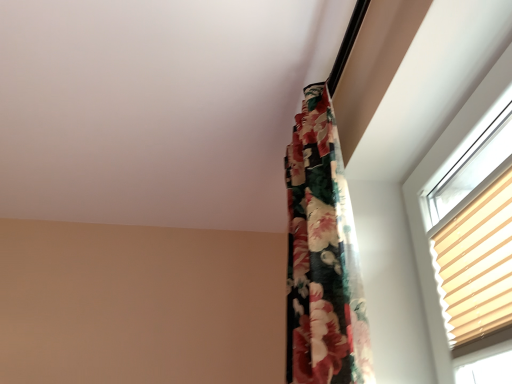
The height and width of the screenshot is (384, 512). What do you see at coordinates (322, 256) in the screenshot?
I see `floral fabric curtain at upper right` at bounding box center [322, 256].

The height and width of the screenshot is (384, 512). I want to click on floral fabric curtain at upper right, so click(x=322, y=256).

Where is `beige pleated blind at upper right`? This screenshot has width=512, height=384. beige pleated blind at upper right is located at coordinates (476, 265).

Describe the element at coordinates (476, 265) in the screenshot. Image resolution: width=512 pixels, height=384 pixels. I see `beige pleated blind at upper right` at that location.

What is the approximate width of beige pleated blind at upper right?

beige pleated blind at upper right is 1.61 inches in width.

Locate an element on the screen. This screenshot has width=512, height=384. floral fabric curtain at upper right is located at coordinates (322, 256).

Between beige pleated blind at upper right and floral fabric curtain at upper right, which one appears on the left side from the viewer's perspective?

floral fabric curtain at upper right is more to the left.

Is beige pleated blind at upper right positioned before floral fabric curtain at upper right?

Yes, it is.

Which is farther, [485,306] or [295,159]?

The point [295,159] is farther.

From the image's perspective, is beige pleated blind at upper right on floral fabric curtain at upper right?

Actually, beige pleated blind at upper right appears below floral fabric curtain at upper right in the image.

From a real-world perspective, who is located lower, beige pleated blind at upper right or floral fabric curtain at upper right?

From a 3D spatial view, beige pleated blind at upper right is below.

In terms of width, does beige pleated blind at upper right look wider or thinner when compared to floral fabric curtain at upper right?

Clearly, beige pleated blind at upper right has less width compared to floral fabric curtain at upper right.

Who is shorter, beige pleated blind at upper right or floral fabric curtain at upper right?

beige pleated blind at upper right is shorter.

Which of these two, beige pleated blind at upper right or floral fabric curtain at upper right, is bigger?

With larger size is floral fabric curtain at upper right.

Is floral fabric curtain at upper right surrounded by beige pleated blind at upper right?

No, beige pleated blind at upper right does not contain floral fabric curtain at upper right.

Is beige pleated blind at upper right directly adjacent to floral fabric curtain at upper right?

No.

Is beige pleated blind at upper right facing towards floral fabric curtain at upper right?

No, beige pleated blind at upper right is not facing towards floral fabric curtain at upper right.

How distant is beige pleated blind at upper right from floral fabric curtain at upper right?

beige pleated blind at upper right and floral fabric curtain at upper right are 11.76 inches apart.

You are a GUI agent. You are given a task and a screenshot of the screen. Output one action in this format:
    pyautogui.click(x=<x>, y=<y>)
    Task: Click on the blind on the right of floral fabric curtain at upper right
    The height and width of the screenshot is (384, 512).
    Given the screenshot: What is the action you would take?
    pyautogui.click(x=476, y=265)

Considering the positions of objects floral fabric curtain at upper right and beige pleated blind at upper right in the image provided, who is more to the right, floral fabric curtain at upper right or beige pleated blind at upper right?

From the viewer's perspective, beige pleated blind at upper right appears more on the right side.

Is floral fabric curtain at upper right in front of or behind beige pleated blind at upper right in the image?

In the image, floral fabric curtain at upper right appears behind beige pleated blind at upper right.

Looking at this image, which is closer to the camera, (332, 184) or (473, 305)?

Point (332, 184).

From the image's perspective, between floral fabric curtain at upper right and beige pleated blind at upper right, who is located below?

From the image's view, beige pleated blind at upper right is below.

From a real-world perspective, which is physically above, floral fabric curtain at upper right or beige pleated blind at upper right?

floral fabric curtain at upper right, from a real-world perspective.

Considering the sizes of objects floral fabric curtain at upper right and beige pleated blind at upper right in the image provided, who is wider, floral fabric curtain at upper right or beige pleated blind at upper right?

With larger width is floral fabric curtain at upper right.

Considering the sizes of floral fabric curtain at upper right and beige pleated blind at upper right in the image, is floral fabric curtain at upper right taller or shorter than beige pleated blind at upper right?

Clearly, floral fabric curtain at upper right is taller compared to beige pleated blind at upper right.

Is floral fabric curtain at upper right bigger than beige pleated blind at upper right?

Indeed, floral fabric curtain at upper right has a larger size compared to beige pleated blind at upper right.

Is floral fabric curtain at upper right located outside beige pleated blind at upper right?

Indeed, floral fabric curtain at upper right is completely outside beige pleated blind at upper right.

Is floral fabric curtain at upper right directly adjacent to beige pleated blind at upper right?

No, floral fabric curtain at upper right is not with beige pleated blind at upper right.

Is floral fabric curtain at upper right facing towards beige pleated blind at upper right?

No.

Find the location of a particular element. The width and height of the screenshot is (512, 384). curtain located behind the beige pleated blind at upper right is located at coordinates (322, 256).

The height and width of the screenshot is (384, 512). I want to click on blind to the right of floral fabric curtain at upper right, so click(x=476, y=265).

Where is `curtain that appears behind the beige pleated blind at upper right`? The image size is (512, 384). curtain that appears behind the beige pleated blind at upper right is located at coordinates (322, 256).